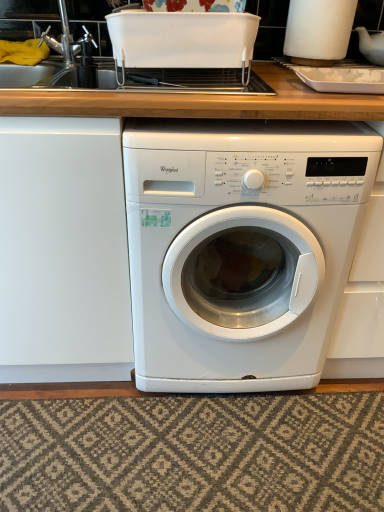
Find the location of a particular element. The width and height of the screenshot is (384, 512). blank area beneath textured beige rug at lower center (from a real-world perspective) is located at coordinates pos(260,470).